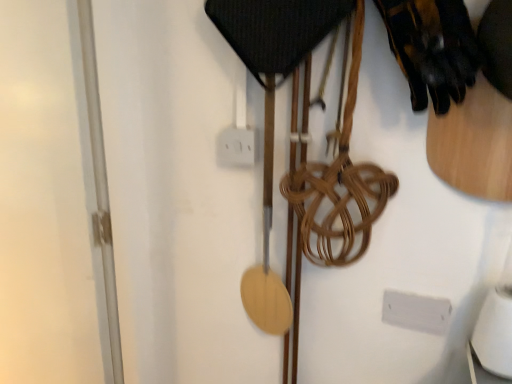
Question: Does transparent glass door at left have a smaller size compared to black leather gloves at upper right?

Choices:
 (A) yes
 (B) no

Answer: (B)

Question: Can we say transparent glass door at left lies outside black leather gloves at upper right?

Choices:
 (A) no
 (B) yes

Answer: (B)

Question: Does transparent glass door at left come in front of black leather gloves at upper right?

Choices:
 (A) yes
 (B) no

Answer: (B)

Question: From a real-world perspective, is transparent glass door at left under black leather gloves at upper right?

Choices:
 (A) yes
 (B) no

Answer: (A)

Question: Does transparent glass door at left have a larger size compared to black leather gloves at upper right?

Choices:
 (A) no
 (B) yes

Answer: (B)

Question: Based on their positions, is white plastic electric outlet at center located to the left or right of black leather gloves at upper right?

Choices:
 (A) left
 (B) right

Answer: (A)

Question: From the image's perspective, is white plastic electric outlet at center above or below black leather gloves at upper right?

Choices:
 (A) below
 (B) above

Answer: (A)

Question: From a real-world perspective, is white plastic electric outlet at center physically located above or below black leather gloves at upper right?

Choices:
 (A) above
 (B) below

Answer: (B)

Question: Is point (222, 139) closer or farther from the camera than point (475, 48)?

Choices:
 (A) farther
 (B) closer

Answer: (A)

Question: Is transparent glass door at left wider or thinner than black leather gloves at upper right?

Choices:
 (A) thin
 (B) wide

Answer: (A)

Question: Considering their positions, is transparent glass door at left located in front of or behind black leather gloves at upper right?

Choices:
 (A) front
 (B) behind

Answer: (B)

Question: Which is correct: transparent glass door at left is inside black leather gloves at upper right, or outside of it?

Choices:
 (A) inside
 (B) outside

Answer: (B)

Question: In terms of height, does transparent glass door at left look taller or shorter compared to black leather gloves at upper right?

Choices:
 (A) tall
 (B) short

Answer: (A)

Question: Is white plastic electric outlet at center inside or outside of transparent glass door at left?

Choices:
 (A) inside
 (B) outside

Answer: (B)

Question: From a real-world perspective, relative to transparent glass door at left, is white plastic electric outlet at center vertically above or below?

Choices:
 (A) above
 (B) below

Answer: (A)